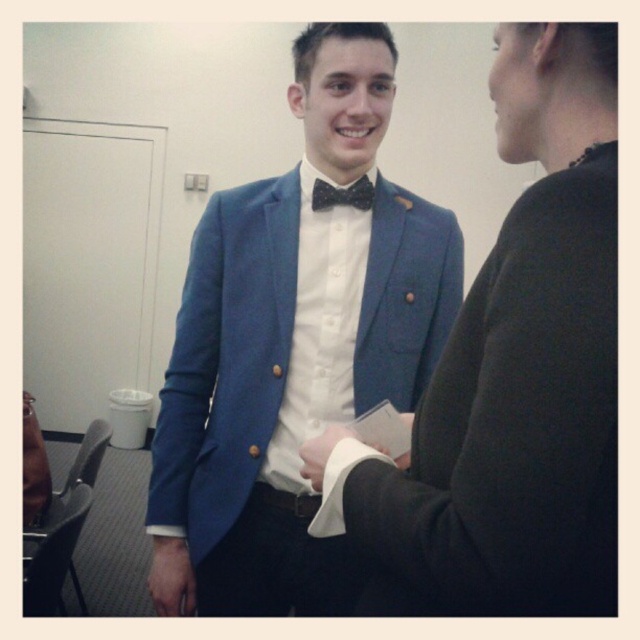
Between matte blue suit at center and matte blue blazer at center, which one is positioned lower?

matte blue blazer at center

Between point (292, 362) and point (561, 419), which one is positioned in front?

Point (561, 419)

This screenshot has height=640, width=640. I want to click on matte blue suit at center, so click(292, 344).

Can you confirm if matte blue blazer at center is wider than black satin bow tie at center?

Correct, the width of matte blue blazer at center exceeds that of black satin bow tie at center.

Is point (525, 468) positioned in front of point (355, 182)?

That is True.

Which is behind, point (598, 612) or point (369, 198)?

The point (369, 198) is behind.

Locate an element on the screen. This screenshot has height=640, width=640. matte blue blazer at center is located at coordinates (512, 376).

Is matte blue suit at center smaller than black satin bow tie at center?

Incorrect, matte blue suit at center is not smaller in size than black satin bow tie at center.

Is point (337, 100) closer to camera compared to point (365, 200)?

Yes, point (337, 100) is in front of point (365, 200).

Does point (208, 600) come behind point (339, 202)?

Yes, it is behind point (339, 202).

At what (x,y) coordinates should I click in order to perform the action: click on matte blue suit at center. Please return your answer as a coordinate pair (x, y). Looking at the image, I should click on (292, 344).